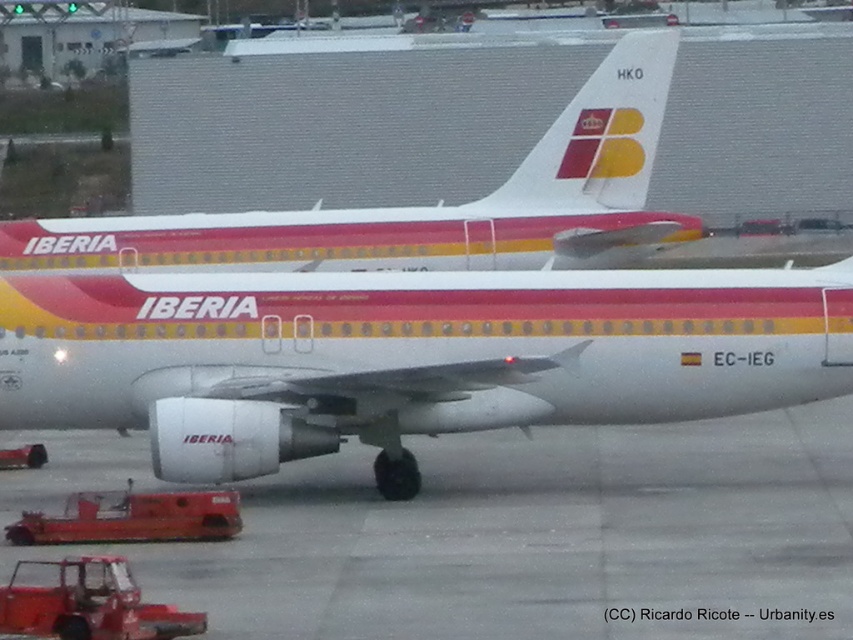
You are a maintenance worker who needs to access both the white glossy airplane at center and the white textured tail at center using a ladder that is 1.2 meters long. Can you reach both objects with the ladder without moving it?

The white glossy airplane at center and white textured tail at center are 1.19 meters apart, so yes, the ladder can reach both objects since the distance between them is less than the ladder length of 1.2 meters.

You are a photographer standing on the tarmac and want to capture the white glossy airplane at center and the white textured tail at center in a single shot. Which object should you frame first to ensure both are fully visible in the photo?

You should frame the white glossy airplane at center first because its width surpasses the white textured tail at center, so capturing the wider object first ensures both fit within the frame.

You are a ground crew member needing to park another vehicle on the tarmac. Based on the scene, can the white smooth tarmac at center accommodate a vehicle as wide as the white glossy airplane at center?

The white smooth tarmac at center has a lesser width compared to white glossy airplane at center, so it cannot accommodate a vehicle as wide as the white glossy airplane at center.